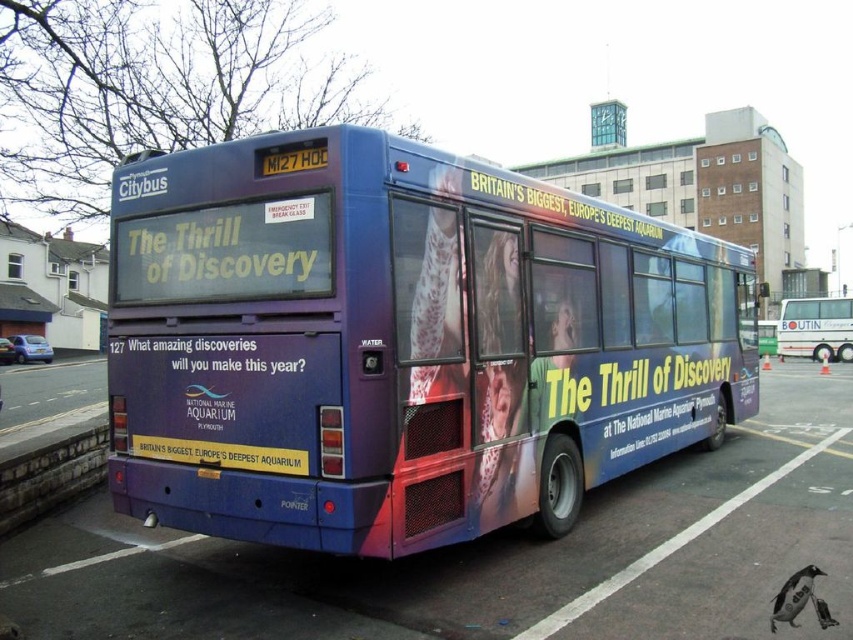
You are a city planner analyzing bus sizes for parking spaces. You observe the matte purple bus at center and the matte white bus at center in the image. Which bus requires a larger parking space?

The matte purple bus at center requires a larger parking space because it has a larger size compared to the matte white bus at center.

You are a photographer trying to capture both the metallic blue bus at center and the matte white bus at center in a single frame. Based on their heights, which bus should you position closer to the camera to ensure both are fully visible in the photo?

The metallic blue bus at center is not as tall as the matte white bus at center. To ensure both are fully visible, position the metallic blue bus at center closer to the camera so its apparent height matches that of the matte white bus at center.